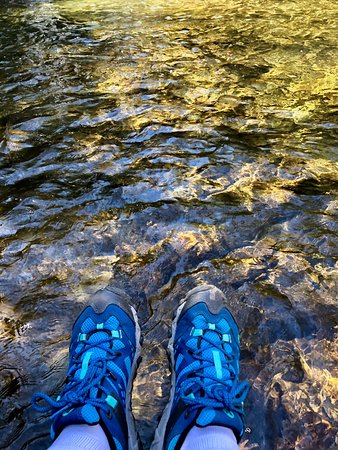
Where is `right white sock`? Image resolution: width=338 pixels, height=450 pixels. right white sock is located at coordinates (213, 441).